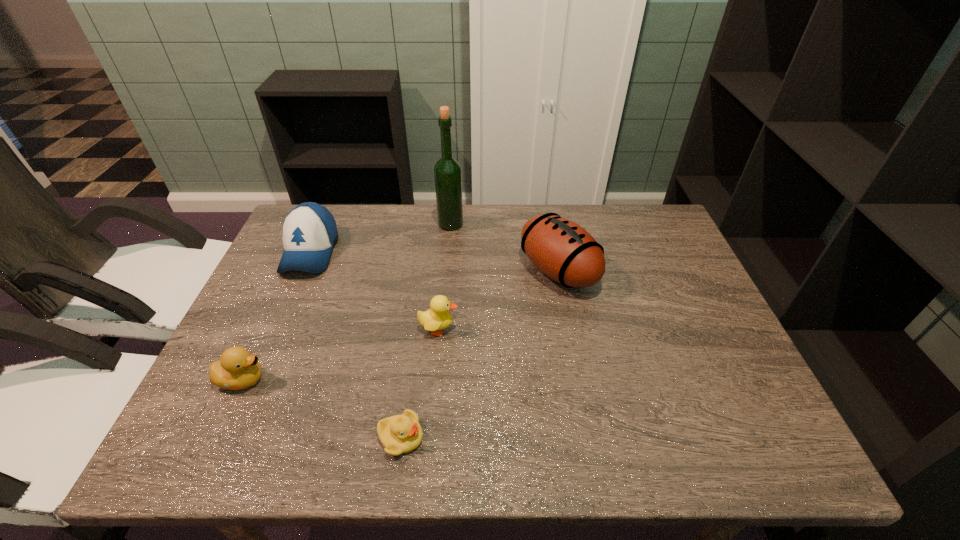
Find the location of `duckling that is at the left edge`. duckling that is at the left edge is located at coordinates (238, 369).

Locate an element on the screen. The image size is (960, 540). object at the far left corner is located at coordinates (309, 231).

You are a GUI agent. You are given a task and a screenshot of the screen. Output one action in this format:
    pyautogui.click(x=<x>, y=<y>)
    Task: Click on the free space at the far edge of the desktop
    
    Given the screenshot: What is the action you would take?
    pyautogui.click(x=407, y=206)

Where is `vacant space at the near edge of the desktop`? This screenshot has width=960, height=540. vacant space at the near edge of the desktop is located at coordinates (504, 459).

Image resolution: width=960 pixels, height=540 pixels. What are the coordinates of `free point at the left edge` in the screenshot? It's located at (241, 329).

Locate an element on the screen. free region at the right edge of the desktop is located at coordinates (692, 316).

Where is `vacant space at the near left corner`? The height and width of the screenshot is (540, 960). vacant space at the near left corner is located at coordinates (247, 449).

At what (x,y) coordinates should I click in order to perform the action: click on vacant space at the far right corner of the desktop. Please return your answer as a coordinate pair (x, y). This screenshot has height=540, width=960. Looking at the image, I should click on (644, 220).

You are a GUI agent. You are given a task and a screenshot of the screen. Output one action in this format:
    pyautogui.click(x=<x>, y=<y>)
    Task: Click on the vacant point located between the farthest duckling and the second farthest duckling
    The width and height of the screenshot is (960, 540).
    Given the screenshot: What is the action you would take?
    pyautogui.click(x=341, y=354)

Locate an element on the screen. Image resolution: width=960 pixels, height=540 pixels. empty location between the liquor and the second tallest object is located at coordinates (505, 247).